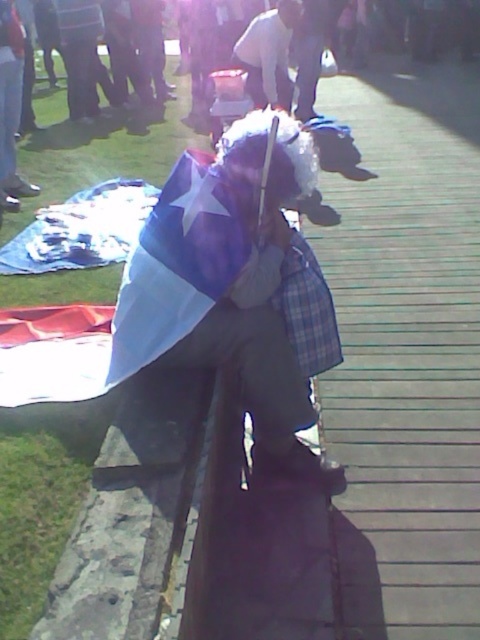
Who is shorter, blue fabric flag at center or white fabric flag at center?

white fabric flag at center is shorter.

Who is higher up, blue fabric flag at center or white fabric flag at center?

blue fabric flag at center is above.

Is point (262, 410) in front of point (69, 348)?

That is True.

The height and width of the screenshot is (640, 480). I want to click on blue fabric flag at center, so click(226, 278).

Does blue fabric flag at center have a lesser width compared to white cotton shirt at center?

Incorrect, blue fabric flag at center's width is not less than white cotton shirt at center's.

Can you confirm if blue fabric flag at center is bigger than white cotton shirt at center?

Incorrect, blue fabric flag at center is not larger than white cotton shirt at center.

Which is behind, point (272, 340) or point (276, 61)?

The point (276, 61) is behind.

At what (x,y) coordinates should I click in order to perform the action: click on blue fabric flag at center. Please return your answer as a coordinate pair (x, y). This screenshot has width=480, height=640. Looking at the image, I should click on (226, 278).

Can you confirm if white fabric flag at center is wider than white cotton shirt at center?

Yes, white fabric flag at center is wider than white cotton shirt at center.

Is white fabric flag at center in front of white cotton shirt at center?

Yes.

Is point (175, 214) positioned behind point (275, 83)?

No, (175, 214) is in front of (275, 83).

At what (x,y) coordinates should I click in order to perform the action: click on white fabric flag at center. Please return your answer as a coordinate pair (x, y). Image resolution: width=480 pixels, height=640 pixels. Looking at the image, I should click on (145, 291).